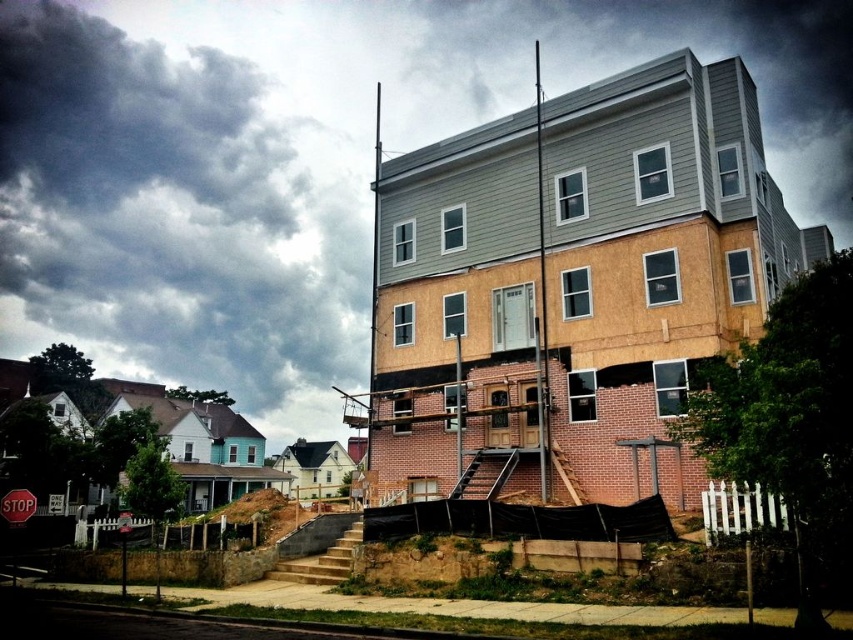
You are a construction worker standing at the entrance of the building. You need to locate the smooth gray siding at upper center. According to the coordinates provided, where exactly should you look?

The smooth gray siding at upper center is located at point coordinates of [312,161].

In the scene shown: What is the coordinate of the cloudy sky at upper left in the image?

The cloudy sky at upper left is located at coordinate point (189, 200).

You are standing at the entrance of the construction site and see the point marked at coordinates (312, 161). Based on the scene, what type of material is this point located on?

The point marked at coordinates (312, 161) is located on smooth gray siding at upper center.